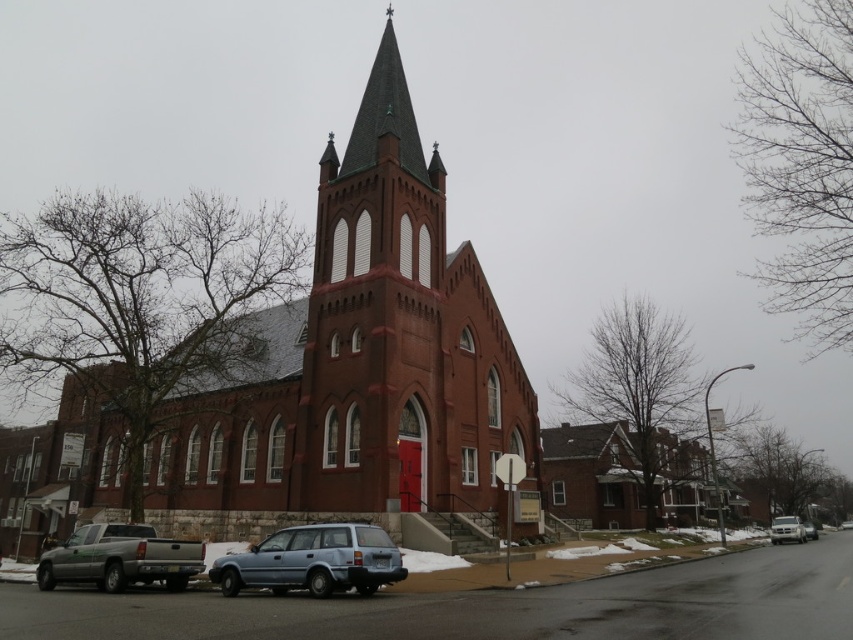
Question: Does smooth brick tower at center have a greater width compared to light blue matte wagon at lower center?

Choices:
 (A) yes
 (B) no

Answer: (A)

Question: Can you confirm if smooth brick tower at center is positioned above silver metallic truck at lower left?

Choices:
 (A) no
 (B) yes

Answer: (B)

Question: Is light blue matte wagon at lower center thinner than silver metallic sedan at lower right?

Choices:
 (A) no
 (B) yes

Answer: (B)

Question: Which of these objects is positioned farthest from the light blue matte wagon at lower center?

Choices:
 (A) smooth brick tower at center
 (B) metallic silver car at center
 (C) metallic silver sedan at center

Answer: (B)

Question: Which point appears farthest from the camera in this image?

Choices:
 (A) (778, 516)
 (B) (846, 520)
 (C) (310, 481)
 (D) (810, 524)

Answer: (B)

Question: Which point is closer to the camera taking this photo?

Choices:
 (A) (842, 522)
 (B) (84, 547)
 (C) (770, 524)

Answer: (B)